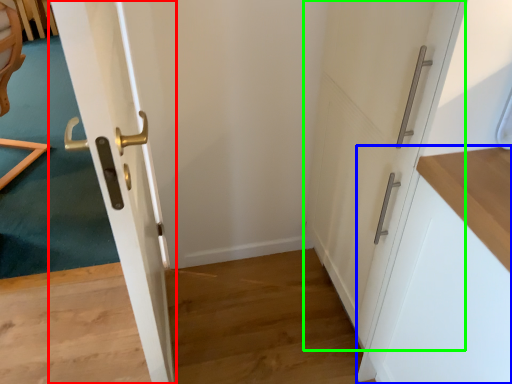
Question: Which object is positioned closest to door (highlighted by a red box)? Select from cabinetry (highlighted by a blue box) and door (highlighted by a green box).

Choices:
 (A) cabinetry
 (B) door

Answer: (B)